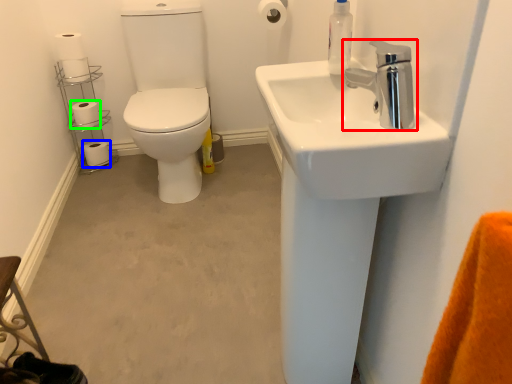
Question: Which object is positioned farthest from tap (highlighted by a red box)? Select from toilet paper (highlighted by a blue box) and toilet paper (highlighted by a green box).

Choices:
 (A) toilet paper
 (B) toilet paper

Answer: (A)